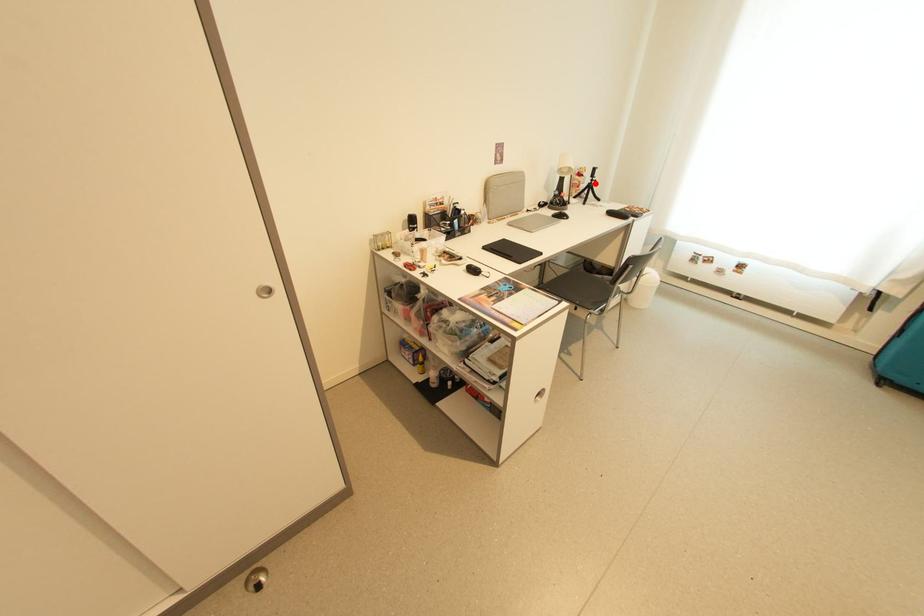
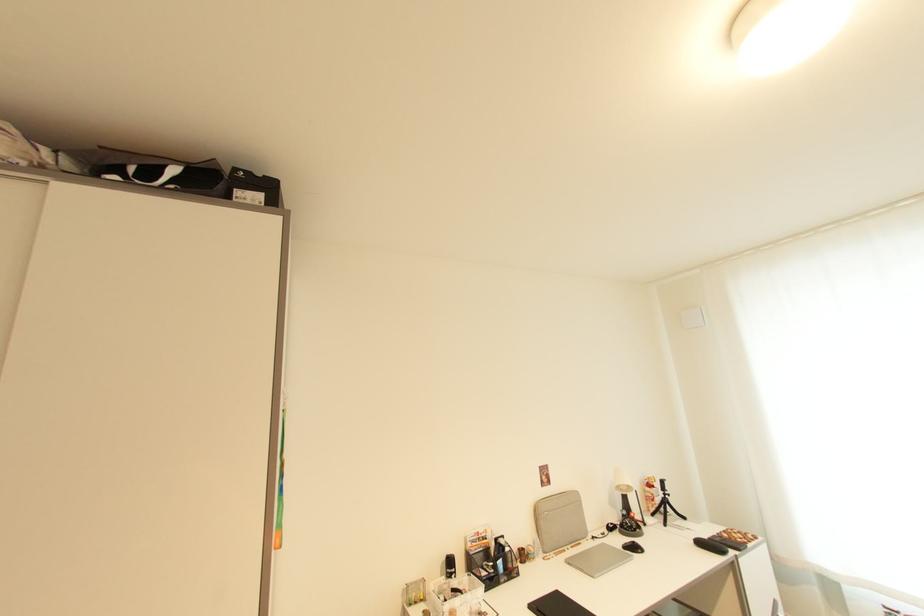
Question: I am providing you with two images of the same scene from different viewpoints. Image1 has a red point marked. In image2, the corresponding 3D location appears at what relative position? Reply with the corresponding letter.

Choices:
 (A) Closer
 (B) Farther

Answer: (B)